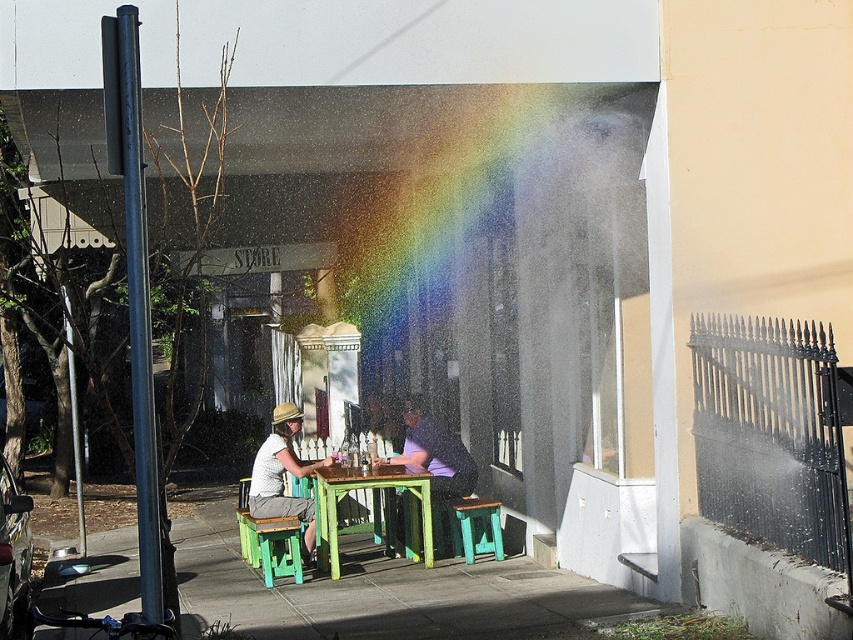
Which is below, green painted wood table at center or matte white shirt at center?

Positioned lower is green painted wood table at center.

Does green painted wood table at center appear under matte white shirt at center?

Indeed, green painted wood table at center is positioned under matte white shirt at center.

Does point (375, 515) lie behind point (297, 432)?

Yes, point (375, 515) is behind point (297, 432).

Find the location of `green painted wood table at center`. green painted wood table at center is located at coordinates (372, 508).

Is the position of green painted wood table at center more distant than that of purple matte shirt at center?

No.

You are a GUI agent. You are given a task and a screenshot of the screen. Output one action in this format:
    pyautogui.click(x=<x>, y=<y>)
    Task: Click on the green painted wood table at center
    
    Given the screenshot: What is the action you would take?
    pyautogui.click(x=372, y=508)

Is point (389, 538) behind point (418, 433)?

Yes, it is.

Where is `green painted wood table at center`? This screenshot has width=853, height=640. green painted wood table at center is located at coordinates (372, 508).

Which of these two, purple matte shirt at center or green painted wood stool at lower center, stands taller?

Standing taller between the two is purple matte shirt at center.

Does purple matte shirt at center lie behind green painted wood stool at lower center?

That is True.

Locate an element on the screen. Image resolution: width=853 pixels, height=640 pixels. purple matte shirt at center is located at coordinates (434, 454).